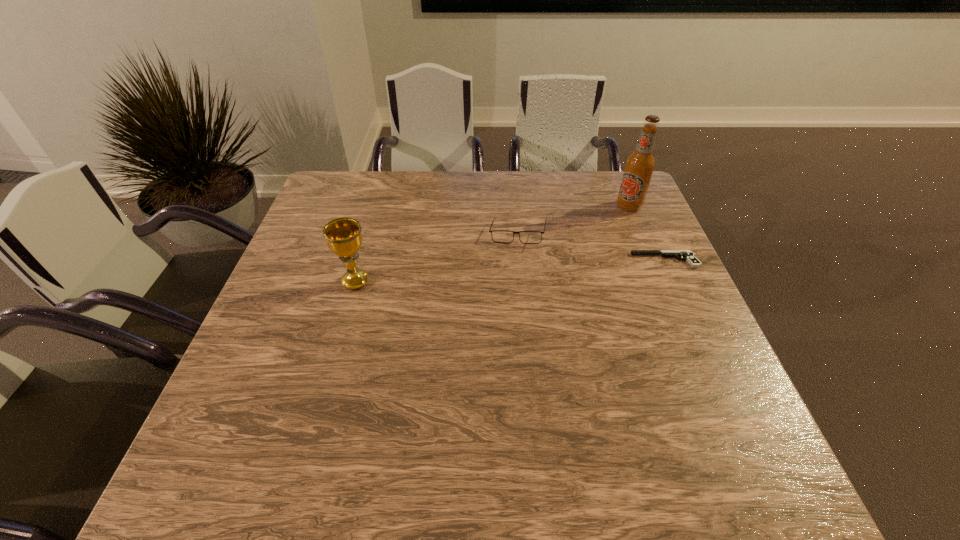
The width and height of the screenshot is (960, 540). I want to click on vacant area in the image that satisfies the following two spatial constraints: 1. on the back side of the second object from left to right; 2. on the right side of the chalice, so click(370, 235).

This screenshot has height=540, width=960. Find the location of `free spot that satisfies the following two spatial constraints: 1. on the back side of the second tallest object; 2. on the left side of the beer bottle`. free spot that satisfies the following two spatial constraints: 1. on the back side of the second tallest object; 2. on the left side of the beer bottle is located at coordinates (377, 206).